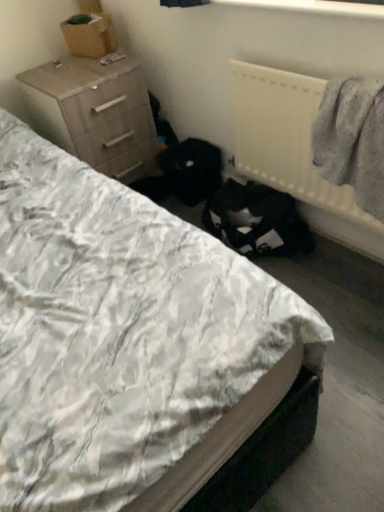
What do you see at coordinates (352, 140) in the screenshot? I see `gray woolen sweater at right` at bounding box center [352, 140].

Identify the location of light brown wood chest of drawers at upper left. Image resolution: width=384 pixels, height=512 pixels. (95, 113).

Is white quilted bed at center not inside white plastic radiator at upper right?

Yes, white quilted bed at center is outside of white plastic radiator at upper right.

From the image's perspective, is white quilted bed at center located above or below white plastic radiator at upper right?

From the image's perspective, white quilted bed at center appears below white plastic radiator at upper right.

Is gray woolen sweater at right surrounding white plastic radiator at upper right?

Yes, white plastic radiator at upper right is inside gray woolen sweater at right.

Considering the positions of point (351, 88) and point (292, 163), is point (351, 88) closer or farther from the camera than point (292, 163)?

Point (351, 88) is positioned closer to the camera compared to point (292, 163).

From a real-world perspective, is gray woolen sweater at right on white plastic radiator at upper right?

Yes, from a real-world perspective, gray woolen sweater at right is on top of white plastic radiator at upper right.

Between gray woolen sweater at right and white plastic radiator at upper right, which one has smaller size?

white plastic radiator at upper right.

Is gray woolen sweater at right aimed at light brown wood chest of drawers at upper left?

No.

Based on the photo, is gray woolen sweater at right taller than light brown wood chest of drawers at upper left?

No, gray woolen sweater at right is not taller than light brown wood chest of drawers at upper left.

Considering the positions of objects gray woolen sweater at right and light brown wood chest of drawers at upper left in the image provided, who is more to the left, gray woolen sweater at right or light brown wood chest of drawers at upper left?

light brown wood chest of drawers at upper left.

Consider the image. Which point is more distant from viewer, (x=357, y=134) or (x=111, y=121)?

Positioned behind is point (x=111, y=121).

From the image's perspective, who appears lower, white plastic radiator at upper right or light brown wood chest of drawers at upper left?

white plastic radiator at upper right, from the image's perspective.

From a real-world perspective, is white plastic radiator at upper right positioned under light brown wood chest of drawers at upper left based on gravity?

Incorrect, from a real-world perspective, white plastic radiator at upper right is higher than light brown wood chest of drawers at upper left.

Between point (315, 177) and point (35, 70), which one is positioned in front?

Positioned in front is point (315, 177).

In the scene shown: From a real-world perspective, is light brown wood chest of drawers at upper left positioned over white quilted bed at center based on gravity?

No, from a real-world perspective, light brown wood chest of drawers at upper left is not above white quilted bed at center.

Locate an element on the screen. This screenshot has height=512, width=384. bed that is on the left side of light brown wood chest of drawers at upper left is located at coordinates coord(118,331).

Looking at their sizes, would you say light brown wood chest of drawers at upper left is wider or thinner than white quilted bed at center?

Clearly, light brown wood chest of drawers at upper left has less width compared to white quilted bed at center.

From a real-world perspective, is white quilted bed at center positioned above or below light brown wood chest of drawers at upper left?

In terms of real-world spatial position, white quilted bed at center is above light brown wood chest of drawers at upper left.

Looking at this image, can you see white quilted bed at center touching light brown wood chest of drawers at upper left?

No, white quilted bed at center is not making contact with light brown wood chest of drawers at upper left.

From the image's perspective, which one is positioned higher, white quilted bed at center or light brown wood chest of drawers at upper left?

light brown wood chest of drawers at upper left is shown above in the image.

Does white quilted bed at center turn towards light brown wood chest of drawers at upper left?

No.

In terms of height, does light brown wood chest of drawers at upper left look taller or shorter compared to gray woolen sweater at right?

Considering their sizes, light brown wood chest of drawers at upper left has more height than gray woolen sweater at right.

Is light brown wood chest of drawers at upper left far away from gray woolen sweater at right?

Yes.

Which of these two, light brown wood chest of drawers at upper left or gray woolen sweater at right, is smaller?

With smaller size is gray woolen sweater at right.

Choose the correct answer: Is light brown wood chest of drawers at upper left inside gray woolen sweater at right or outside it?

light brown wood chest of drawers at upper left lies outside gray woolen sweater at right.

The height and width of the screenshot is (512, 384). In order to click on bed located in front of the white plastic radiator at upper right in this screenshot , I will do `click(118, 331)`.

You are a GUI agent. You are given a task and a screenshot of the screen. Output one action in this format:
    pyautogui.click(x=<x>, y=<y>)
    Task: Click on the clothing that is below the white plastic radiator at upper right (from the image's perspective)
    The height and width of the screenshot is (512, 384).
    Given the screenshot: What is the action you would take?
    pyautogui.click(x=352, y=140)

Looking at the image, which one is located closer to white plastic radiator at upper right, gray woolen sweater at right or white quilted bed at center?

Based on the image, gray woolen sweater at right appears to be nearer to white plastic radiator at upper right.

Which object lies further to the anchor point gray woolen sweater at right, white quilted bed at center or light brown wood chest of drawers at upper left?

Based on the image, light brown wood chest of drawers at upper left appears to be further to gray woolen sweater at right.

Considering their positions, is white quilted bed at center positioned further to light brown wood chest of drawers at upper left than white plastic radiator at upper right?

Among the two, white plastic radiator at upper right is located further to light brown wood chest of drawers at upper left.

Which object lies nearer to the anchor point white plastic radiator at upper right, gray woolen sweater at right or light brown wood chest of drawers at upper left?

gray woolen sweater at right.

From the image, which object appears to be farther from light brown wood chest of drawers at upper left, white plastic radiator at upper right or gray woolen sweater at right?

gray woolen sweater at right is positioned further to the anchor light brown wood chest of drawers at upper left.

Considering their positions, is light brown wood chest of drawers at upper left positioned closer to gray woolen sweater at right than white quilted bed at center?

white quilted bed at center lies closer to gray woolen sweater at right than the other object.

Which object lies nearer to the anchor point light brown wood chest of drawers at upper left, gray woolen sweater at right or white quilted bed at center?

The object closer to light brown wood chest of drawers at upper left is white quilted bed at center.

Considering their positions, is white plastic radiator at upper right positioned closer to light brown wood chest of drawers at upper left than white quilted bed at center?

white quilted bed at center lies closer to light brown wood chest of drawers at upper left than the other object.

You are a GUI agent. You are given a task and a screenshot of the screen. Output one action in this format:
    pyautogui.click(x=<x>, y=<y>)
    Task: Click on the radiator located between white quilted bed at center and light brown wood chest of drawers at upper left in the depth direction
    This screenshot has height=512, width=384.
    Given the screenshot: What is the action you would take?
    pyautogui.click(x=285, y=137)

The height and width of the screenshot is (512, 384). In order to click on radiator between white quilted bed at center and gray woolen sweater at right in the horizontal direction in this screenshot , I will do `click(285, 137)`.

Find the location of a particular element. The image size is (384, 512). radiator situated between light brown wood chest of drawers at upper left and gray woolen sweater at right from left to right is located at coordinates (285, 137).

Where is `clothing positioned between white quilted bed at center and light brown wood chest of drawers at upper left from near to far`? The width and height of the screenshot is (384, 512). clothing positioned between white quilted bed at center and light brown wood chest of drawers at upper left from near to far is located at coordinates (352, 140).